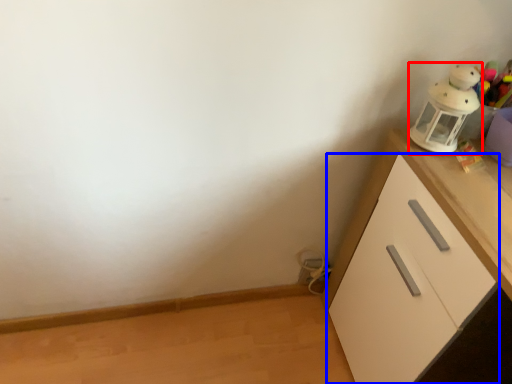
Question: Which object is further to the camera taking this photo, toy (highlighted by a red box) or cabinetry (highlighted by a blue box)?

Choices:
 (A) toy
 (B) cabinetry

Answer: (A)